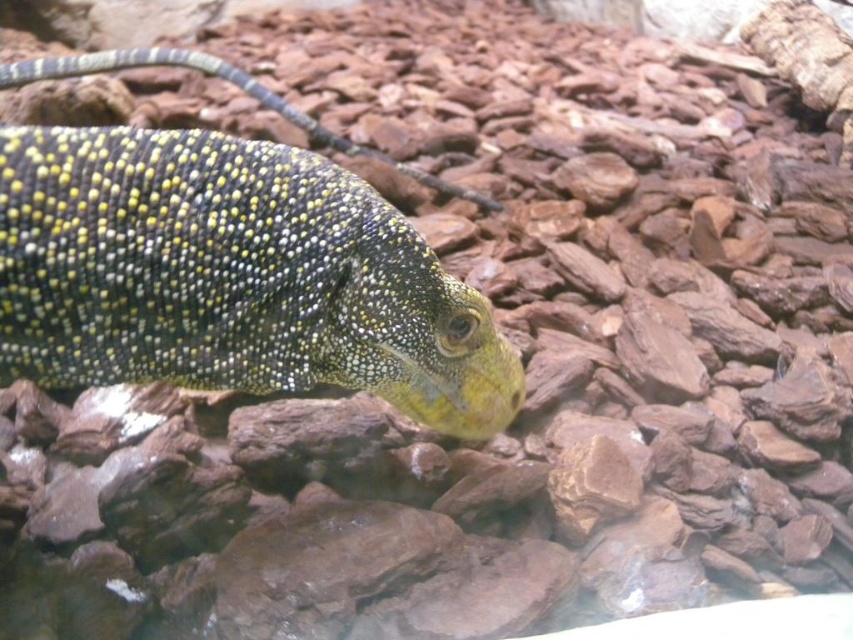
Which of these two, shiny green scales at center or shiny yellow scales at center, stands shorter?

With less height is shiny yellow scales at center.

Find the location of `shiny green scales at center`. shiny green scales at center is located at coordinates (231, 276).